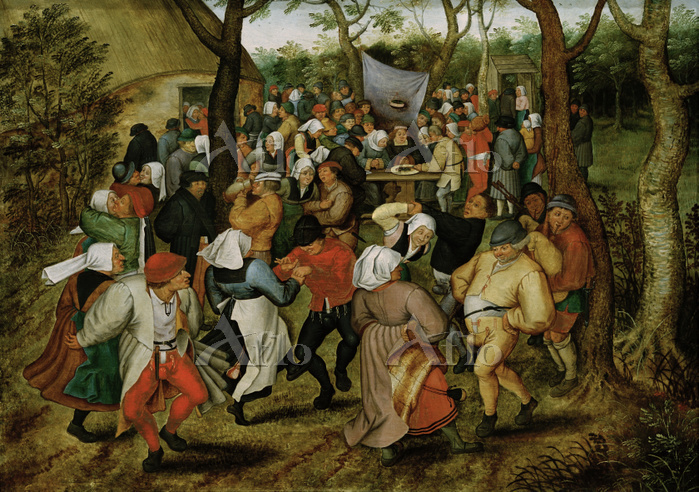
What are the coordinates of `door` in the screenshot? It's located at (505, 83), (198, 97).